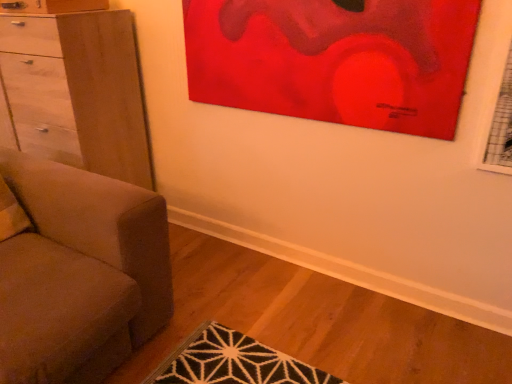
Question: Is light brown wood chest of drawers at left wider than matte red painting at upper center?

Choices:
 (A) yes
 (B) no

Answer: (A)

Question: Is light brown wood chest of drawers at left thinner than matte red painting at upper center?

Choices:
 (A) no
 (B) yes

Answer: (A)

Question: Considering the relative sizes of light brown wood chest of drawers at left and matte red painting at upper center in the image provided, is light brown wood chest of drawers at left smaller than matte red painting at upper center?

Choices:
 (A) yes
 (B) no

Answer: (B)

Question: Is light brown wood chest of drawers at left not within matte red painting at upper center?

Choices:
 (A) no
 (B) yes

Answer: (B)

Question: From a real-world perspective, is light brown wood chest of drawers at left located beneath matte red painting at upper center?

Choices:
 (A) yes
 (B) no

Answer: (A)

Question: Visually, is light brown wood chest of drawers at left positioned to the left or to the right of matte gray couch at left?

Choices:
 (A) right
 (B) left

Answer: (B)

Question: From a real-world perspective, is light brown wood chest of drawers at left above or below matte gray couch at left?

Choices:
 (A) below
 (B) above

Answer: (B)

Question: From the image's perspective, is light brown wood chest of drawers at left positioned above or below matte gray couch at left?

Choices:
 (A) below
 (B) above

Answer: (B)

Question: Is point (55, 59) closer or farther from the camera than point (22, 160)?

Choices:
 (A) closer
 (B) farther

Answer: (B)

Question: Based on their sizes in the image, would you say matte red painting at upper center is bigger or smaller than matte gray couch at left?

Choices:
 (A) small
 (B) big

Answer: (A)

Question: Is matte red painting at upper center to the left or to the right of matte gray couch at left in the image?

Choices:
 (A) right
 (B) left

Answer: (A)

Question: In the image, is matte red painting at upper center positioned in front of or behind matte gray couch at left?

Choices:
 (A) behind
 (B) front

Answer: (A)

Question: Is point (406, 0) positioned closer to the camera than point (78, 208)?

Choices:
 (A) closer
 (B) farther

Answer: (A)

Question: In terms of height, does light brown wood chest of drawers at left look taller or shorter compared to matte red painting at upper center?

Choices:
 (A) short
 (B) tall

Answer: (B)

Question: Looking at the image, does light brown wood chest of drawers at left seem bigger or smaller compared to matte red painting at upper center?

Choices:
 (A) big
 (B) small

Answer: (A)